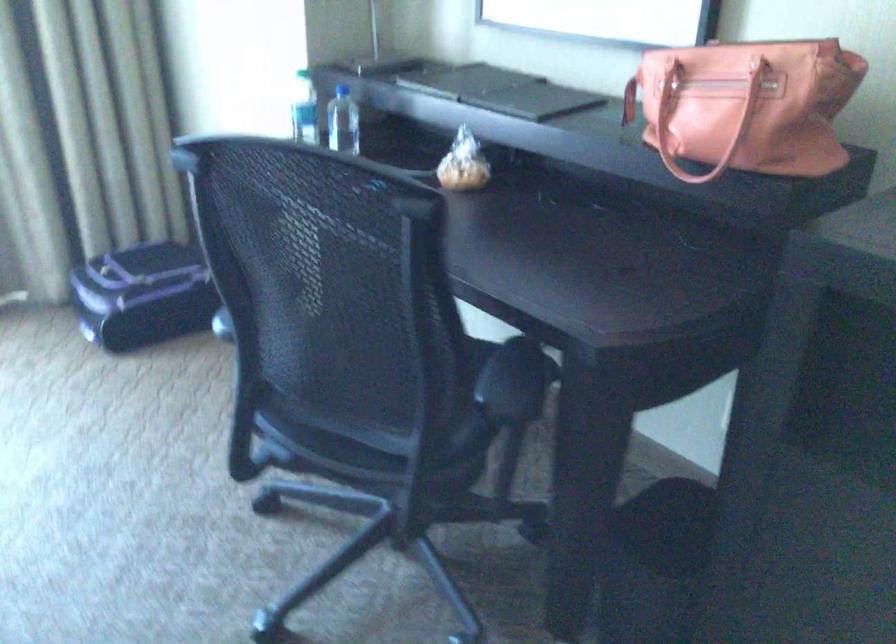
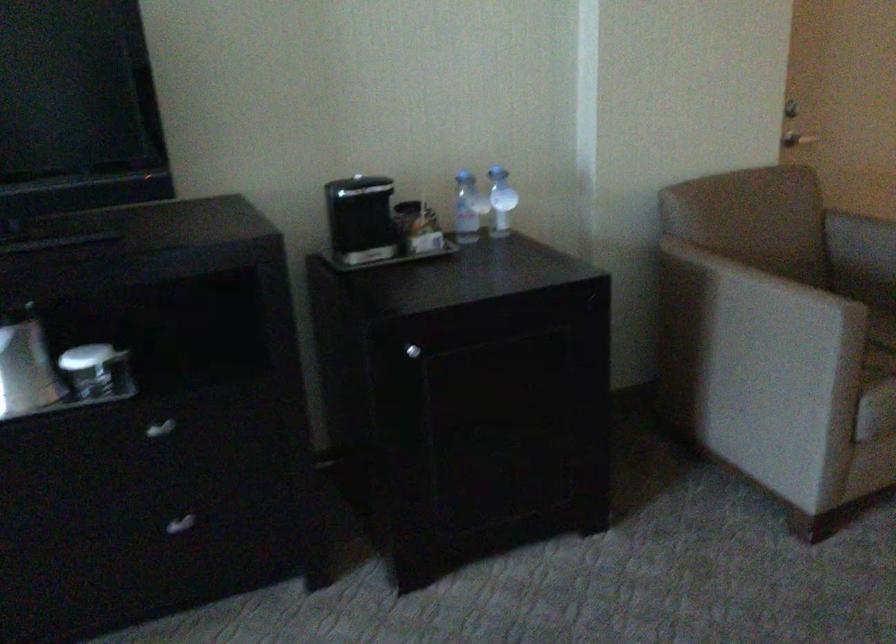
Question: The first image is from the beginning of the video and the second image is from the end. How did the camera likely rotate when shooting the video?

Choices:
 (A) Left
 (B) Right
 (C) Up
 (D) Down

Answer: (B)